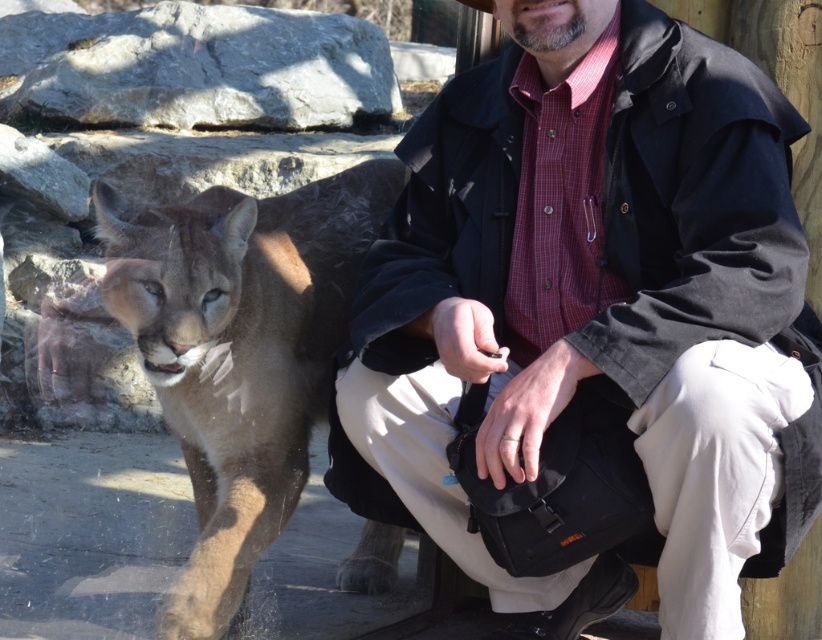
Question: Is matte black jacket at center wider than brown fur cougar at left?

Choices:
 (A) yes
 (B) no

Answer: (A)

Question: Where is matte black jacket at center located in relation to brown fur cougar at left in the image?

Choices:
 (A) above
 (B) below

Answer: (B)

Question: Does matte black jacket at center appear on the left side of brown fur cougar at left?

Choices:
 (A) yes
 (B) no

Answer: (B)

Question: Which object is farther from the camera taking this photo?

Choices:
 (A) brown fur cougar at left
 (B) matte black jacket at center

Answer: (A)